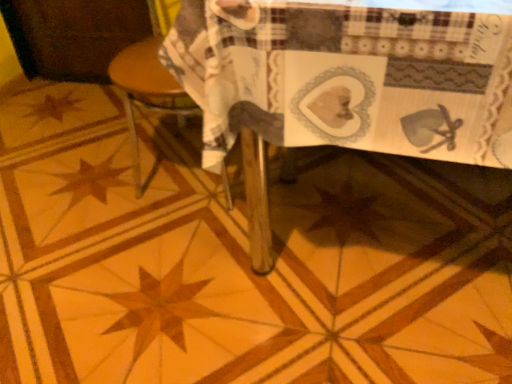
What do you see at coordinates (341, 84) in the screenshot?
I see `wooden table at center` at bounding box center [341, 84].

The image size is (512, 384). What are the coordinates of `wooden table at center` in the screenshot? It's located at (341, 84).

Where is `wooden table at center`? wooden table at center is located at coordinates (341, 84).